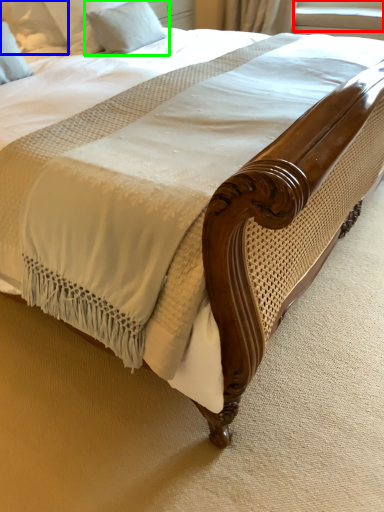
Question: Which object is the farthest from window screen (highlighted by a red box)? Choose among these: pillow (highlighted by a blue box) or pillow (highlighted by a green box).

Choices:
 (A) pillow
 (B) pillow

Answer: (A)